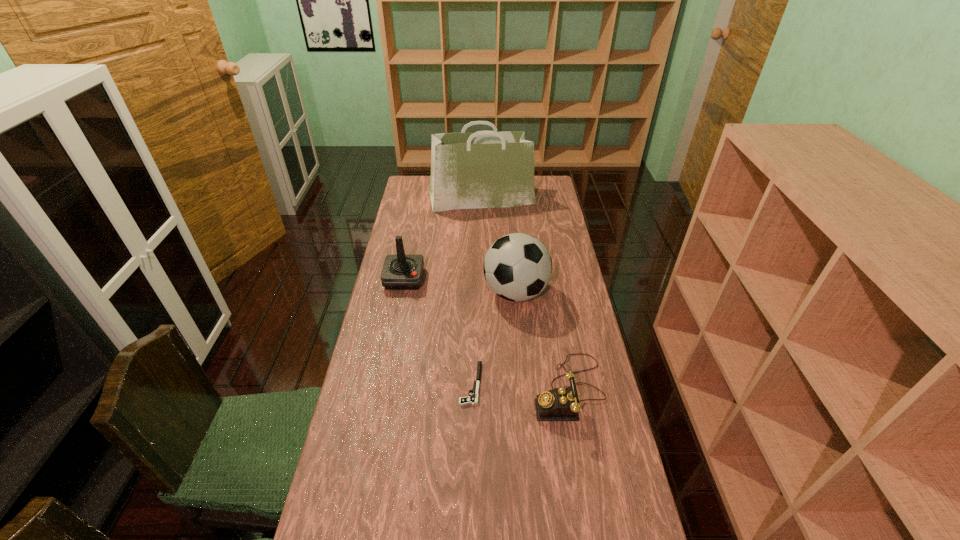
Find the location of a particular element. The image size is (960, 540). the farthest object is located at coordinates pyautogui.click(x=487, y=169).

The image size is (960, 540). Identify the location of grocery bag. (487, 169).

This screenshot has width=960, height=540. Find the location of `the fourth shortest object`. the fourth shortest object is located at coordinates (517, 267).

You are a GUI agent. You are given a task and a screenshot of the screen. Output one action in this format:
    pyautogui.click(x=<x>, y=<y>)
    Task: Click on the joystick
    This screenshot has height=540, width=960.
    Given the screenshot: What is the action you would take?
    tap(400, 272)

Locate an element on the screen. telephone is located at coordinates (560, 404).

I want to click on pistol, so click(473, 399).

What are the coordinates of `blank space located 0.240m on the front of the grocery bag` in the screenshot? It's located at (481, 244).

Locate an element on the screen. This screenshot has width=960, height=540. vacant space located 0.150m on the back of the second tallest object is located at coordinates (512, 248).

Identify the location of free region located on the front-facing side of the joystick. This screenshot has width=960, height=540. (396, 323).

The image size is (960, 540). Find the location of `vacant region located on the dial of the telephone`. vacant region located on the dial of the telephone is located at coordinates (493, 390).